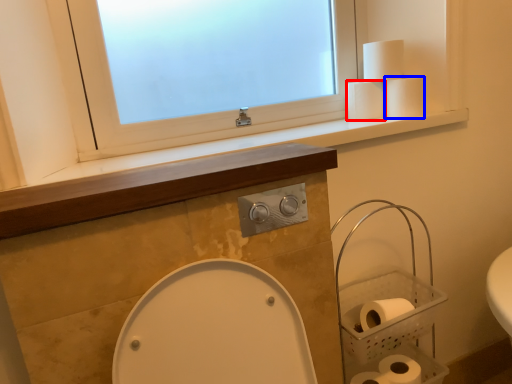
Question: Which point is closer to the camera, toilet paper (highlighted by a red box) or toilet paper (highlighted by a blue box)?

Choices:
 (A) toilet paper
 (B) toilet paper

Answer: (B)